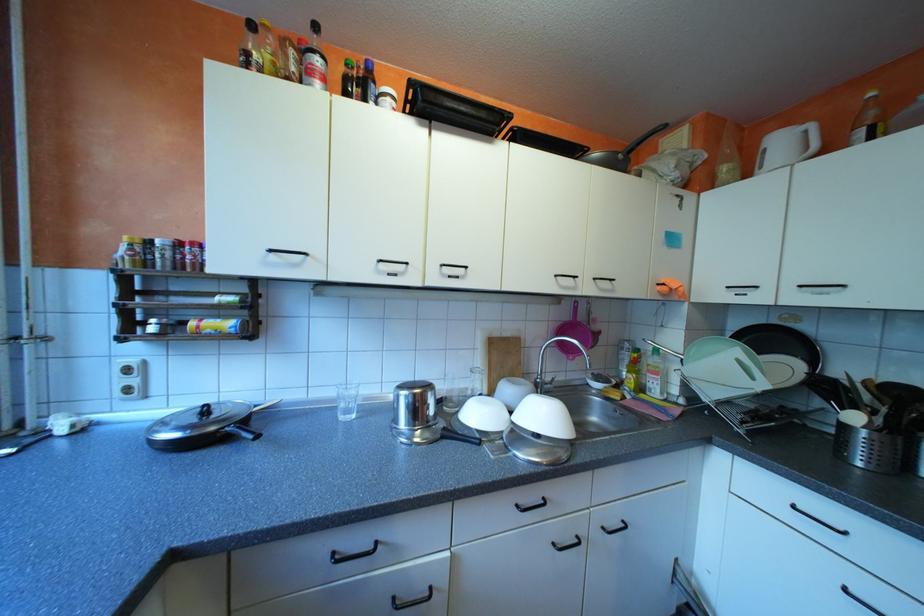
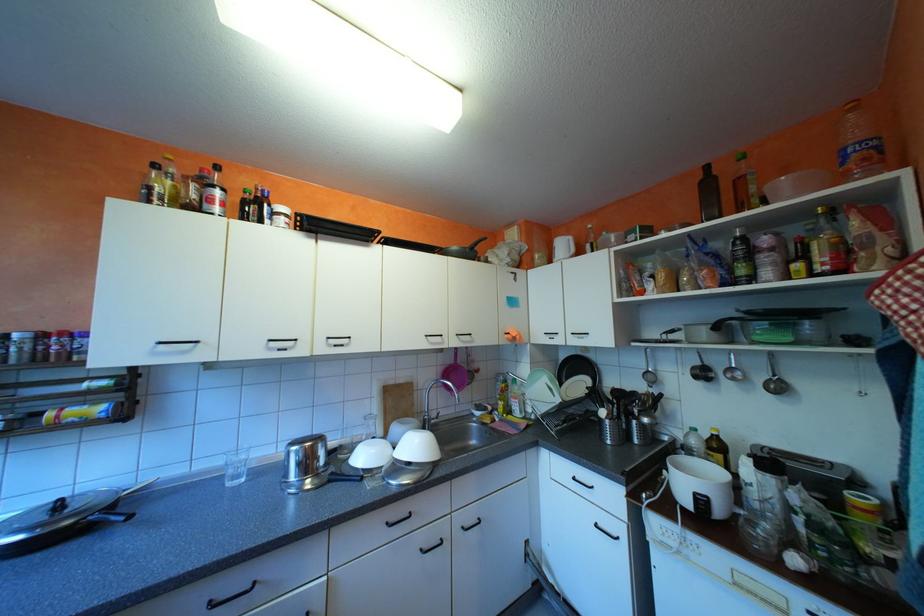
In the second image, find the point that corresponds to (x=529, y=505) in the first image.

(398, 523)